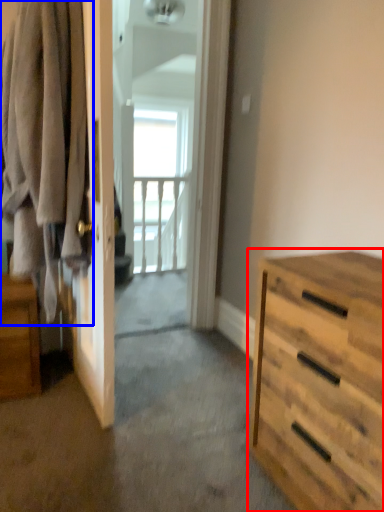
Question: Which of the following is the closest to the observer, chest of drawers (highlighted by a red box) or clothing (highlighted by a blue box)?

Choices:
 (A) chest of drawers
 (B) clothing

Answer: (A)